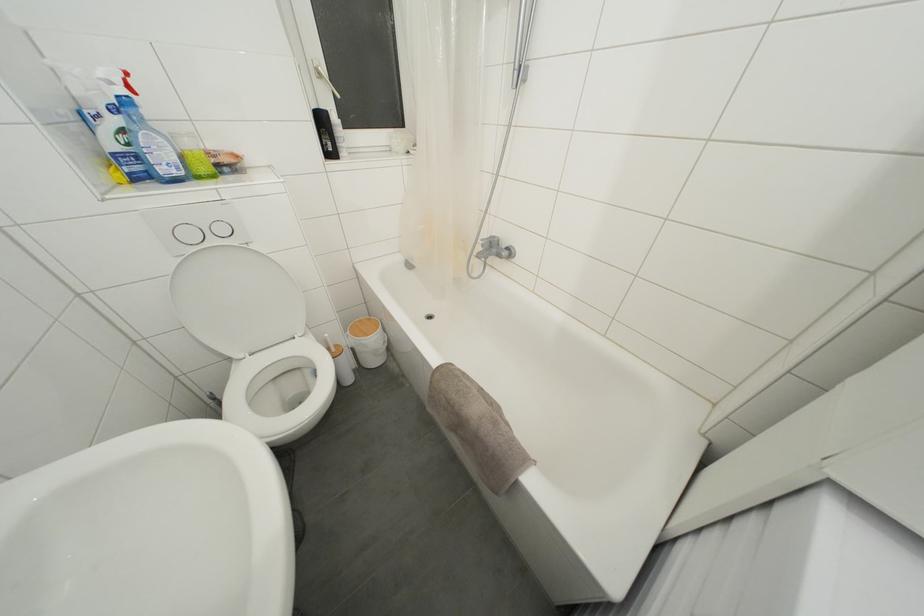
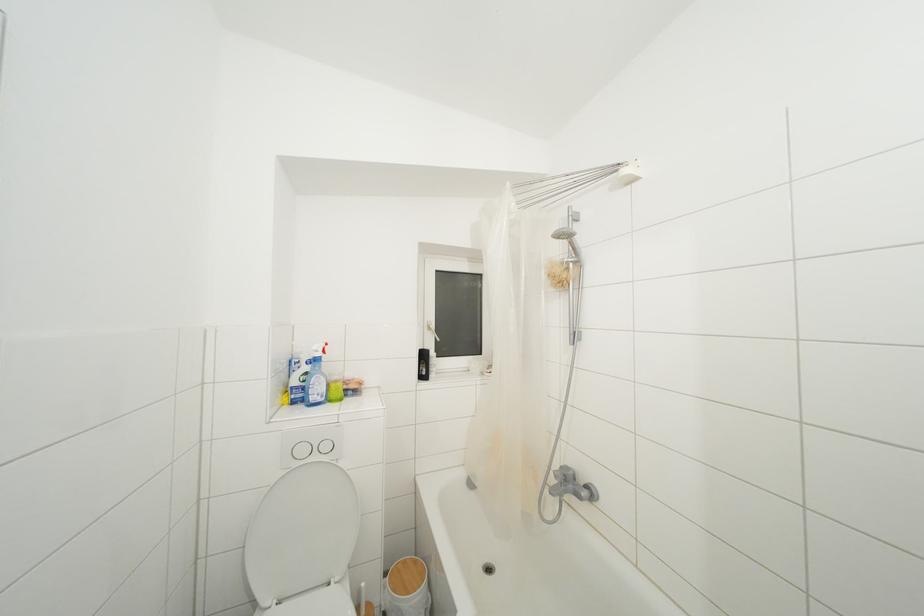
The point at (363, 326) is marked in the first image. Where is the corresponding point in the second image?

(408, 567)